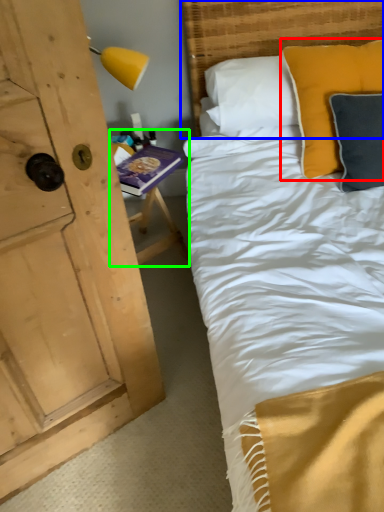
Question: Which is farther away from pillow (highlighted by a red box)? headboard (highlighted by a blue box) or table (highlighted by a green box)?

Choices:
 (A) headboard
 (B) table

Answer: (B)